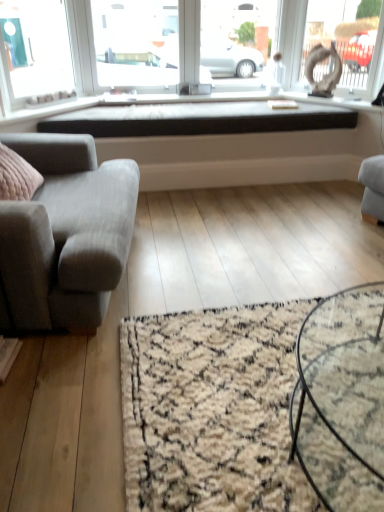
Measure the distance between point (346,315) and camera.

Point (346,315) and camera are 4.83 feet apart.

What do you see at coordinates (256, 406) in the screenshot?
I see `beige shaggy rug at lower center` at bounding box center [256, 406].

This screenshot has height=512, width=384. Find the location of `gray fabric couch at left`. gray fabric couch at left is located at coordinates (65, 234).

Locate an element on the screen. This screenshot has width=384, height=512. black matte window sill at center is located at coordinates (197, 119).

Where is `black glass coffee table at center`? black glass coffee table at center is located at coordinates (343, 399).

From the image's perspective, which is below, transparent glass window screen at upper center or matte white statue at upper right?

From the image's view, matte white statue at upper right is below.

Relative to matte white statue at upper right, is transparent glass window screen at upper center in front or behind?

transparent glass window screen at upper center is positioned farther from the viewer than matte white statue at upper right.

Considering the relative sizes of transparent glass window screen at upper center and matte white statue at upper right in the image provided, is transparent glass window screen at upper center smaller than matte white statue at upper right?

No, transparent glass window screen at upper center is not smaller than matte white statue at upper right.

Does transparent glass window screen at upper center turn towards matte white statue at upper right?

No, transparent glass window screen at upper center is not oriented towards matte white statue at upper right.

Considering the positions of points (341, 10) and (135, 26), is point (341, 10) farther from camera compared to point (135, 26)?

No, it is in front of (135, 26).

From a real-world perspective, who is located lower, matte white statue at upper right or transparent glass window screen at upper center?

transparent glass window screen at upper center is physically lower.

Between matte white statue at upper right and transparent glass window screen at upper center, which one appears on the right side from the viewer's perspective?

From the viewer's perspective, matte white statue at upper right appears more on the right side.

Which is more to the right, black glass coffee table at center or transparent glass window screen at upper center?

black glass coffee table at center.

Considering the relative sizes of black glass coffee table at center and transparent glass window screen at upper center in the image provided, is black glass coffee table at center thinner than transparent glass window screen at upper center?

In fact, black glass coffee table at center might be wider than transparent glass window screen at upper center.

Where is `coffee table beneath the transparent glass window screen at upper center (from a real-world perspective)`? The height and width of the screenshot is (512, 384). coffee table beneath the transparent glass window screen at upper center (from a real-world perspective) is located at coordinates (343, 399).

Is point (359, 298) positioned in front of point (201, 75)?

Yes, point (359, 298) is in front of point (201, 75).

Who is bigger, beige shaggy rug at lower center or black glass coffee table at center?

black glass coffee table at center.

Is beige shaggy rug at lower center oriented away from black glass coffee table at center?

No.

From a real-world perspective, is beige shaggy rug at lower center physically below black glass coffee table at center?

Yes, from a real-world perspective, beige shaggy rug at lower center is under black glass coffee table at center.

Considering the relative sizes of beige shaggy rug at lower center and black glass coffee table at center in the image provided, is beige shaggy rug at lower center thinner than black glass coffee table at center?

Incorrect, the width of beige shaggy rug at lower center is not less than that of black glass coffee table at center.

Looking at their sizes, would you say matte white statue at upper right is wider or thinner than beige shaggy rug at lower center?

Clearly, matte white statue at upper right has less width compared to beige shaggy rug at lower center.

Is matte white statue at upper right inside the boundaries of beige shaggy rug at lower center, or outside?

matte white statue at upper right cannot be found inside beige shaggy rug at lower center.

How different are the orientations of matte white statue at upper right and beige shaggy rug at lower center in degrees?

The angular difference between matte white statue at upper right and beige shaggy rug at lower center is 33.9 degrees.

From a real-world perspective, is matte white statue at upper right located beneath beige shaggy rug at lower center?

No.

Considering the sizes of objects black glass coffee table at center and black matte window sill at center in the image provided, who is bigger, black glass coffee table at center or black matte window sill at center?

black matte window sill at center is bigger.

Is black glass coffee table at center aimed at black matte window sill at center?

No, black glass coffee table at center is not turned towards black matte window sill at center.

Which is closer to the camera, (302, 436) or (45, 130)?

Clearly, point (302, 436) is closer to the camera than point (45, 130).

Identify the location of window sill that is above the black glass coffee table at center (from a real-world perspective). (197, 119).

Between matte white statue at upper right and black glass coffee table at center, which one has larger size?

matte white statue at upper right.

Based on the photo, is matte white statue at upper right surrounding black glass coffee table at center?

Definitely not — black glass coffee table at center is not inside matte white statue at upper right.

Does matte white statue at upper right have a lesser width compared to black glass coffee table at center?

Indeed, matte white statue at upper right has a lesser width compared to black glass coffee table at center.

Considering the positions of objects matte white statue at upper right and black glass coffee table at center in the image provided, who is more to the right, matte white statue at upper right or black glass coffee table at center?

matte white statue at upper right is more to the right.

The width and height of the screenshot is (384, 512). Identify the location of window screen behind the matte white statue at upper right. (137, 42).

The height and width of the screenshot is (512, 384). I want to click on window that appears below the transparent glass window screen at upper center (from the image's perspective), so click(x=344, y=36).

Estimate the real-world distances between objects in this image. Which object is closer to gray fabric couch at left, matte white statue at upper right or black glass coffee table at center?

black glass coffee table at center is closer to gray fabric couch at left.

Looking at the image, which one is located closer to transparent glass window screen at upper center, beige shaggy rug at lower center or matte white statue at upper right?

The object closer to transparent glass window screen at upper center is matte white statue at upper right.

Based on their spatial positions, is gray fabric couch at left or black glass coffee table at center closer to matte white statue at upper right?

The object closer to matte white statue at upper right is gray fabric couch at left.

Estimate the real-world distances between objects in this image. Which object is closer to matte white statue at upper right, gray fabric couch at left or black matte window sill at center?

black matte window sill at center is closer to matte white statue at upper right.

Looking at the image, which one is located closer to transparent glass window screen at upper center, black matte window sill at center or gray fabric couch at left?

black matte window sill at center is closer to transparent glass window screen at upper center.

Looking at the image, which one is located closer to transparent glass window screen at upper center, matte white statue at upper right or beige shaggy rug at lower center?

matte white statue at upper right is positioned closer to the anchor transparent glass window screen at upper center.

Looking at this image, estimate the real-world distances between objects in this image. Which object is closer to black matte window sill at center, gray fabric couch at left or matte white statue at upper right?

matte white statue at upper right is closer to black matte window sill at center.

When comparing their distances from matte white statue at upper right, does transparent glass window screen at upper center or black glass coffee table at center seem further?

The object further to matte white statue at upper right is black glass coffee table at center.

I want to click on mat positioned between black glass coffee table at center and transparent glass window screen at upper center from near to far, so click(x=256, y=406).

What are the coordinates of `studio couch between black glass coffee table at center and transparent glass window screen at upper center from front to back` in the screenshot? It's located at (65, 234).

Find the location of a particular element. This screenshot has width=384, height=512. window sill between gray fabric couch at left and matte white statue at upper right from left to right is located at coordinates (197, 119).

Where is `studio couch positioned between black glass coffee table at center and black matte window sill at center from near to far`? studio couch positioned between black glass coffee table at center and black matte window sill at center from near to far is located at coordinates (65, 234).